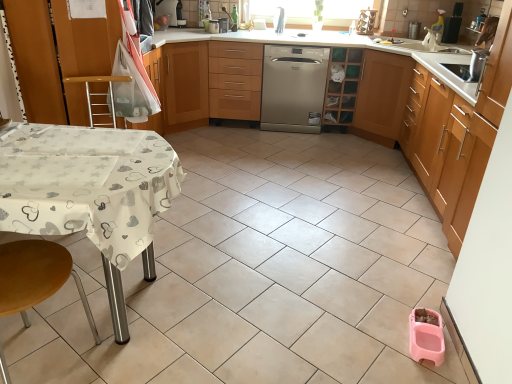
Question: In the image, is metallic silver toaster at upper center, the second appliance positioned from the left, on the left side or the right side of light brown wood cabinet at right, marked as the first cabinetry in a right-to-left arrangement?

Choices:
 (A) left
 (B) right

Answer: (A)

Question: From the image's perspective, relative to light brown wood cabinet at right, placed as the 4th cabinetry when sorted from left to right, is metallic silver toaster at upper center, which appears as the 2th appliance when viewed from the right, above or below?

Choices:
 (A) above
 (B) below

Answer: (A)

Question: Which object is positioned farthest from the satin silver dishwasher at center?

Choices:
 (A) metallic silver toaster at upper center, the second appliance positioned from the left
 (B) light brown wood cabinet at right, placed as the 4th cabinetry when sorted from left to right
 (C) white glossy table at left, placed as the 1th cabinetry when sorted from left to right
 (D) metallic silver spice rack at upper center, the first appliance from the right
 (E) white fabric-covered table at lower left

Answer: (E)

Question: Which of these objects is positioned closest to the wooden step stool at lower left, placed as the first step stool when sorted from front to back?

Choices:
 (A) wooden/metallic step stool at left, which ranks as the 1th step stool in top-to-bottom order
 (B) wooden drawer at center
 (C) satin silver dishwasher at center
 (D) wooden cabinet at upper center, the 2th cabinetry when ordered from left to right
 (E) white glossy table at left, placed as the 1th cabinetry when sorted from left to right

Answer: (E)